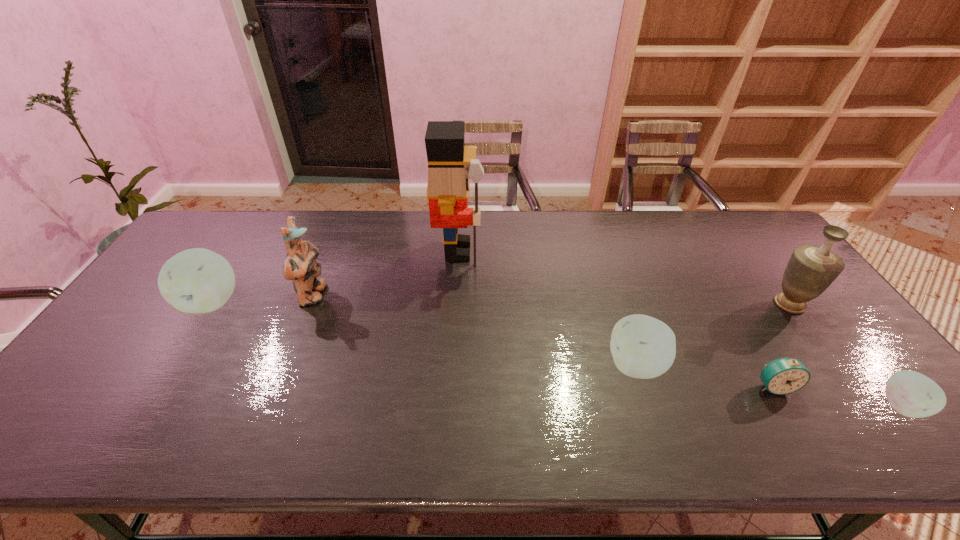
This screenshot has width=960, height=540. I want to click on vacant point located on the front of the leftmost apple, so click(182, 348).

Locate an element on the screen. This screenshot has height=540, width=960. free spot located 0.370m on the left of the second shortest apple is located at coordinates (462, 366).

The height and width of the screenshot is (540, 960). I want to click on vacant position located 0.120m on the back of the shortest apple, so click(855, 349).

The width and height of the screenshot is (960, 540). Find the location of `vacant space located in front of the tallest object holding the staff`. vacant space located in front of the tallest object holding the staff is located at coordinates (601, 251).

Where is `vacant region located on the left of the urn`? vacant region located on the left of the urn is located at coordinates (717, 304).

Identify the location of vacant space located on the front-facing side of the second object from left to right. The height and width of the screenshot is (540, 960). (395, 295).

This screenshot has height=540, width=960. In order to click on object that is at the far edge in this screenshot , I will do `click(448, 186)`.

This screenshot has height=540, width=960. In order to click on alarm clock that is positioned at the near edge in this screenshot , I will do `click(782, 376)`.

Where is `object present at the left edge`? The width and height of the screenshot is (960, 540). object present at the left edge is located at coordinates (198, 280).

The image size is (960, 540). I want to click on apple at the right edge, so click(912, 394).